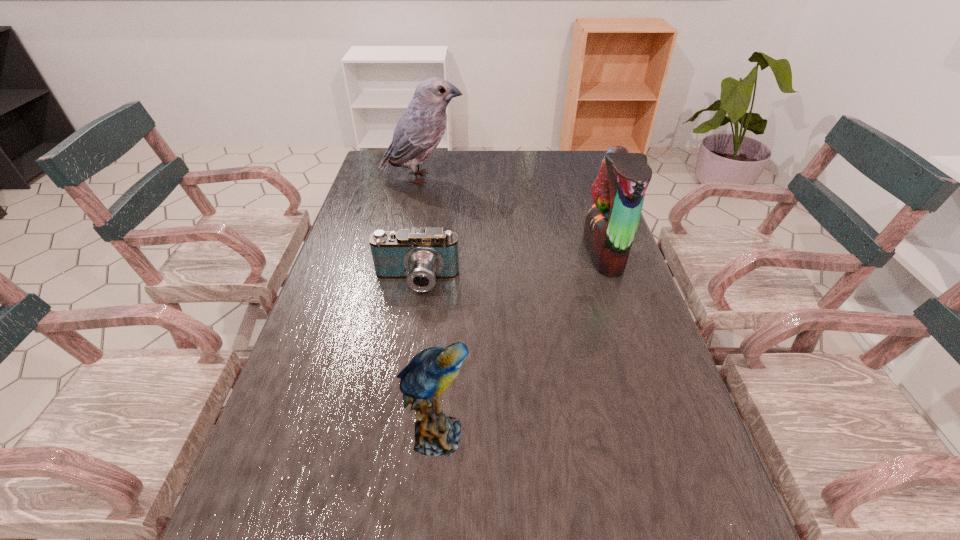
Where is `vacant space located 0.320m on the front-facing side of the camcorder`? This screenshot has width=960, height=540. vacant space located 0.320m on the front-facing side of the camcorder is located at coordinates (396, 413).

Find the location of `object that is positioned at the far edge`. object that is positioned at the far edge is located at coordinates (421, 127).

Locate an element on the screen. parrot that is at the left edge is located at coordinates (421, 127).

Identify the location of camcorder that is at the left edge. The width and height of the screenshot is (960, 540). 421,256.

Where is `object located at the right edge`? The height and width of the screenshot is (540, 960). object located at the right edge is located at coordinates (618, 192).

The image size is (960, 540). In order to click on object at the far left corner in this screenshot , I will do `click(421, 127)`.

In the image, there is a desktop. At what (x,y) coordinates should I click in order to perform the action: click on vacant space at the far edge. Please return your answer as a coordinate pair (x, y). This screenshot has height=540, width=960. Looking at the image, I should click on (478, 152).

The image size is (960, 540). In the image, there is a desktop. Find the location of `vacant space at the left edge`. vacant space at the left edge is located at coordinates (374, 198).

This screenshot has width=960, height=540. Find the location of `free spot at the right edge of the desktop`. free spot at the right edge of the desktop is located at coordinates (688, 488).

What are the coordinates of `vacant space at the far left corner of the desktop` in the screenshot? It's located at (386, 177).